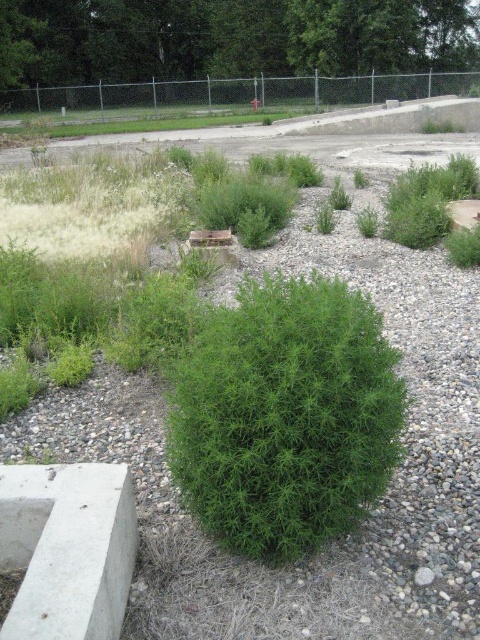
Does green leafy shrub at center appear on the left side of green leafy bush at center?

Incorrect, green leafy shrub at center is not on the left side of green leafy bush at center.

Who is more distant from viewer, [245,346] or [373,42]?

The point [373,42] is behind.

Where is `green leafy shrub at center`? green leafy shrub at center is located at coordinates (286, 416).